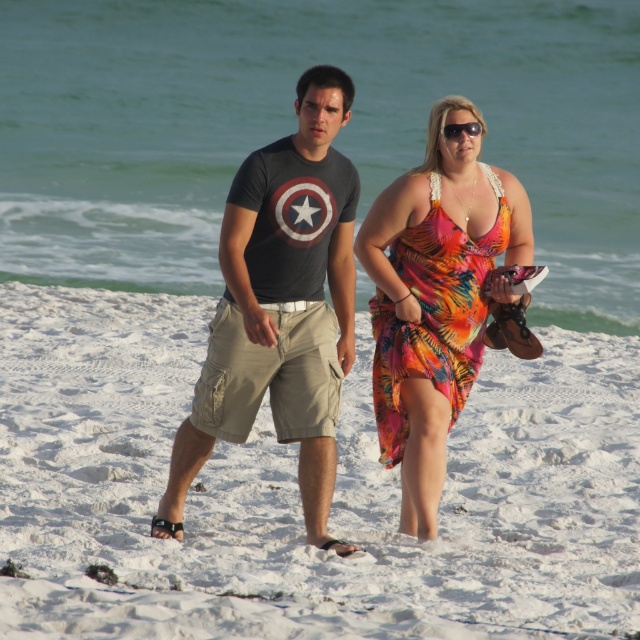
Question: Can you confirm if white sandy beach at center is wider than sunglasses at upper center?

Choices:
 (A) yes
 (B) no

Answer: (A)

Question: Based on their relative distances, which object is nearer to the dark gray t-shirt at center?

Choices:
 (A) sunglasses at upper center
 (B) fuzzy tropical wrap at center
 (C) white sandy beach at center

Answer: (B)

Question: Which of the following is the closest to the observer?

Choices:
 (A) (460, 125)
 (B) (547, 328)
 (C) (445, 288)

Answer: (A)

Question: Does white sandy beach at center have a greater width compared to dark gray t-shirt at center?

Choices:
 (A) yes
 (B) no

Answer: (A)

Question: Can you confirm if dark gray t-shirt at center is thinner than fuzzy tropical wrap at center?

Choices:
 (A) yes
 (B) no

Answer: (B)

Question: Which point is farther from the camera taking this photo?

Choices:
 (A) (449, 128)
 (B) (390, 602)
 (C) (388, 330)
 (D) (202, 388)

Answer: (C)